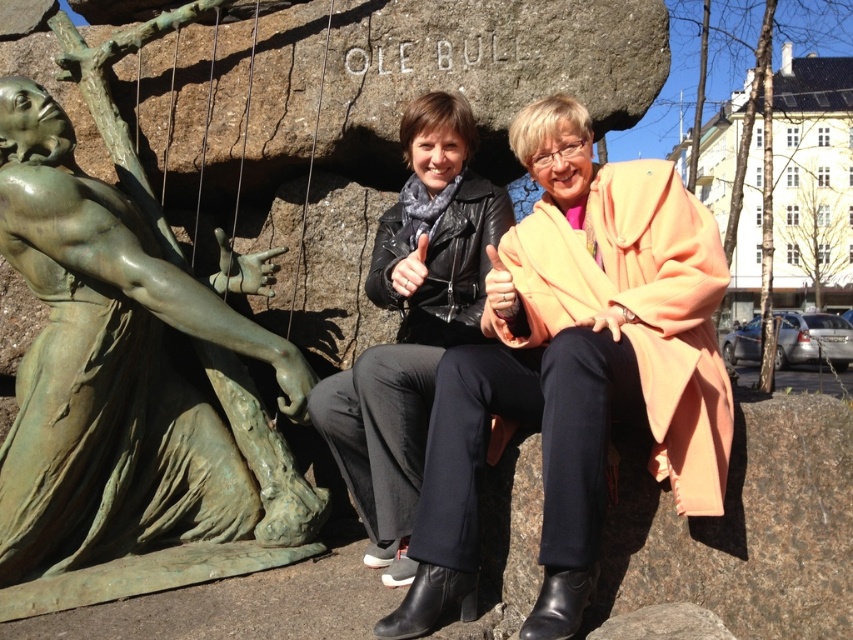
Question: Does green patina bronze statue at left lie behind black leather jacket at center?

Choices:
 (A) yes
 (B) no

Answer: (B)

Question: Can you confirm if matte black leather jacket at center is positioned above black leather jacket at center?

Choices:
 (A) no
 (B) yes

Answer: (A)

Question: Does matte black leather jacket at center have a greater width compared to green patina bronze statue at left?

Choices:
 (A) no
 (B) yes

Answer: (B)

Question: Which point is closer to the camera?

Choices:
 (A) black leather jacket at center
 (B) green patina bronze statue at left
 (C) matte black leather jacket at center

Answer: (C)

Question: Which object is farther from the camera taking this photo?

Choices:
 (A) green patina bronze statue at left
 (B) black leather jacket at center

Answer: (B)

Question: Which point appears closest to the camera in this image?

Choices:
 (A) (90, 280)
 (B) (323, 435)

Answer: (A)